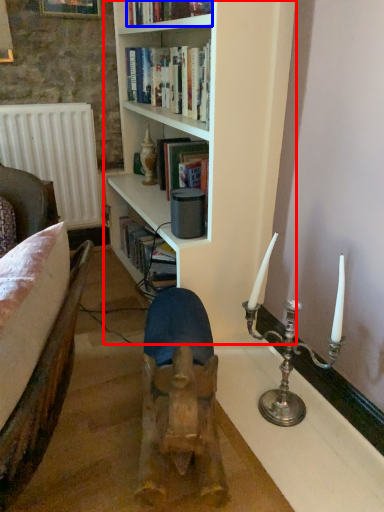
Question: Which of the following is the farthest to the observer, bookcase (highlighted by a red box) or book (highlighted by a blue box)?

Choices:
 (A) bookcase
 (B) book

Answer: (B)